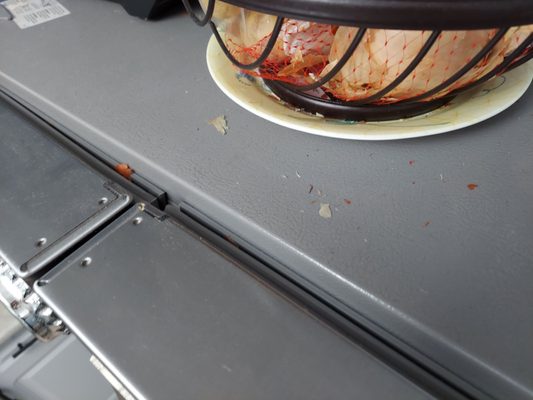
Identify the location of crumb. This screenshot has width=533, height=400. (x=220, y=122), (x=325, y=205).